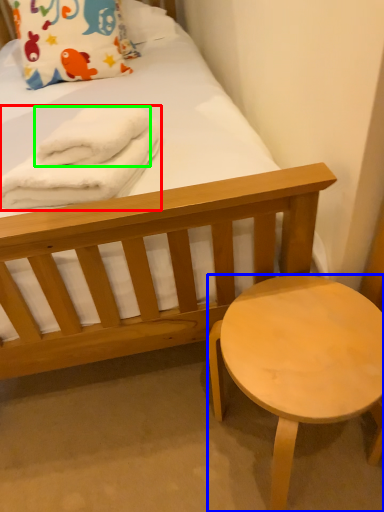
Question: Which object is the closest to the bath towel (highlighted by a red box)? Choose among these: stool (highlighted by a blue box) or bath towel (highlighted by a green box).

Choices:
 (A) stool
 (B) bath towel

Answer: (B)